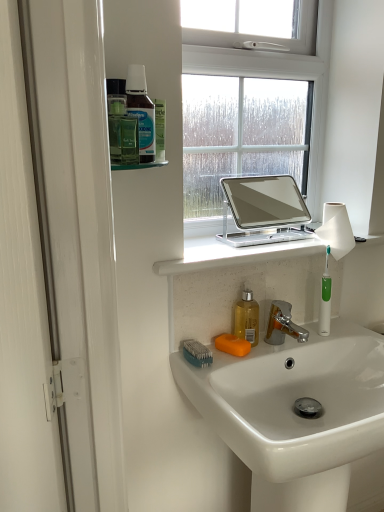
Where is `free space on the front side of translucent yellow liquid at sink, the 1th mouthwash when ordered from right to left`? This screenshot has width=384, height=512. free space on the front side of translucent yellow liquid at sink, the 1th mouthwash when ordered from right to left is located at coordinates (244, 361).